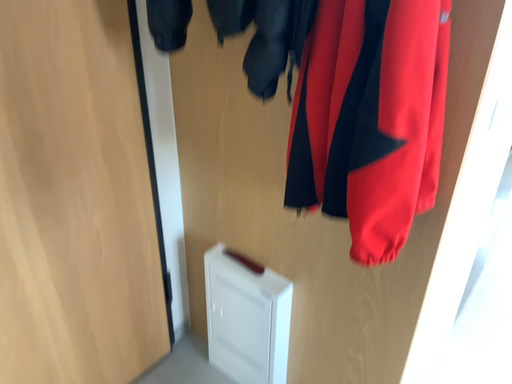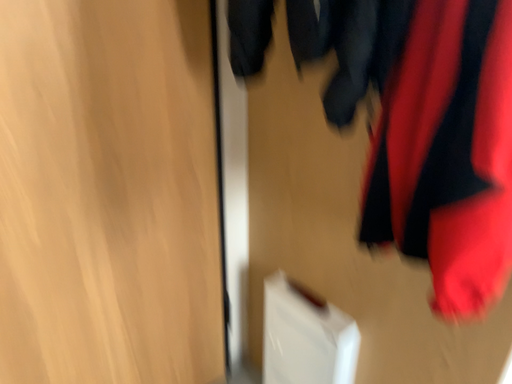
Question: How did the camera likely rotate when shooting the video?

Choices:
 (A) rotated right
 (B) rotated left

Answer: (B)